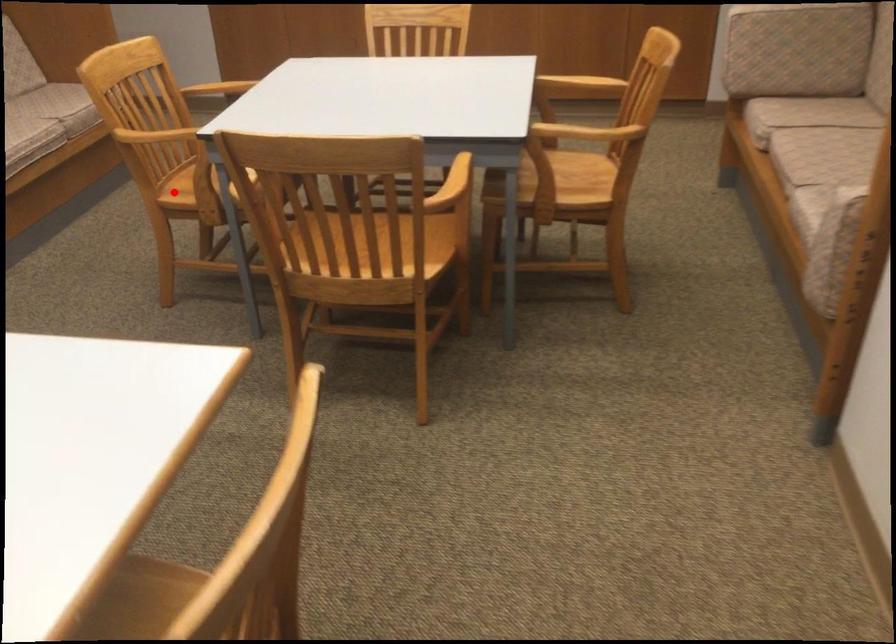
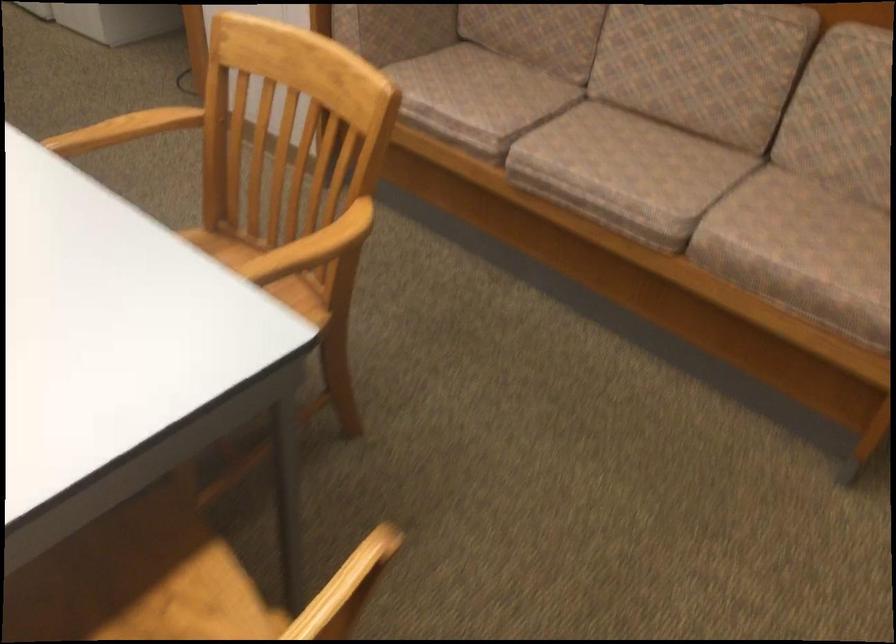
Question: I am providing you with two images of the same scene from different viewpoints. Image1 has a red point marked. In image2, the corresponding 3D location appears at what relative position? Reply with the corresponding letter.

Choices:
 (A) Closer
 (B) Farther

Answer: (A)